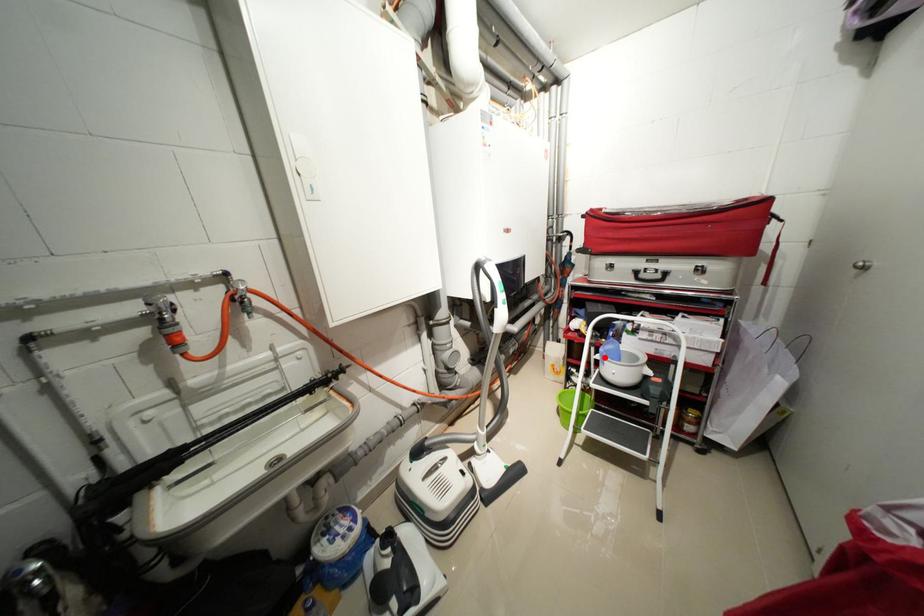
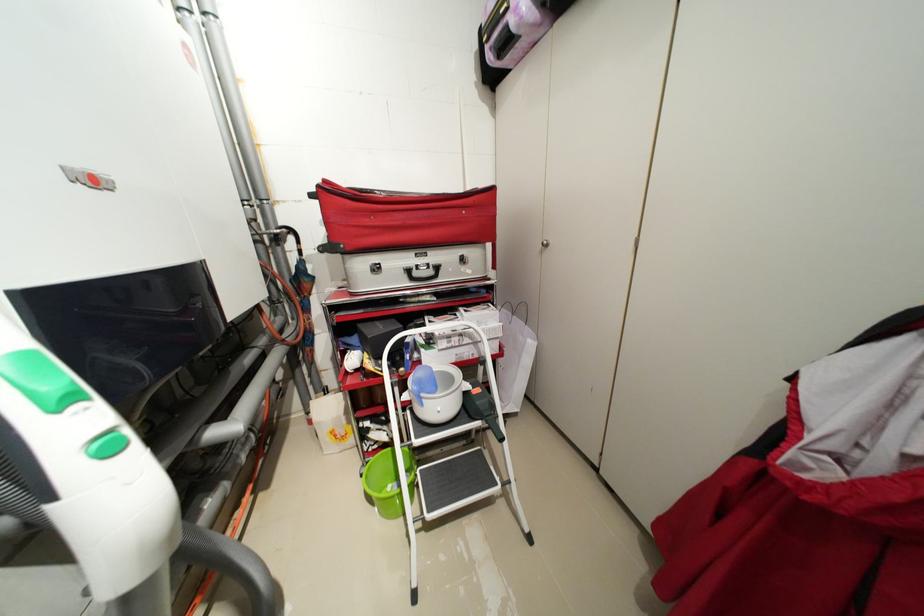
Question: I am providing you with two images of the same scene from different viewpoints. Given a red point in image1, look at the same physical point in image2. Is it:

Choices:
 (A) Closer to the viewpoint
 (B) Farther from the viewpoint

Answer: (B)